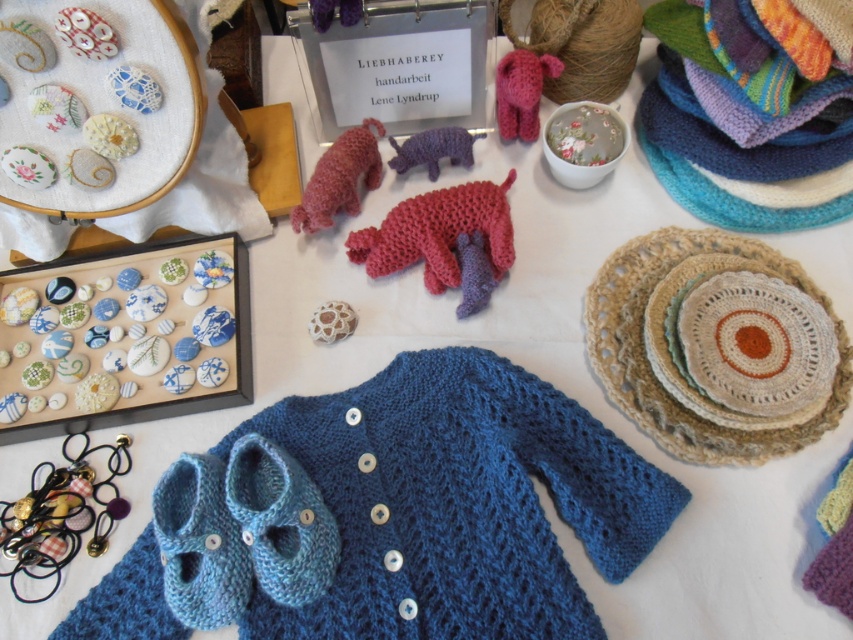
Between knitted wool dog at center and purple knitted toy at center, which one is positioned higher?

purple knitted toy at center is above.

Is knitted wool dog at center to the right of purple knitted toy at center from the viewer's perspective?

Incorrect, knitted wool dog at center is not on the right side of purple knitted toy at center.

Who is more distant from viewer, (291, 227) or (401, 150)?

The point (401, 150) is more distant.

You are a GUI agent. You are given a task and a screenshot of the screen. Output one action in this format:
    pyautogui.click(x=<x>, y=<y>)
    Task: Click on the knitted wool dog at center
    
    Given the screenshot: What is the action you would take?
    pyautogui.click(x=340, y=177)

From the picture: Who is lower down, knitted wool dog at center or knitted pink elephant at upper center?

knitted wool dog at center

Does point (320, 214) come in front of point (518, 54)?

That is True.

Identify the location of knitted wool dog at center. (340, 177).

From the picture: Can you confirm if knitted woolen dog at center is thinner than purple knitted toy at center?

No.

Is knitted woolen dog at center above purple knitted toy at center?

No.

Identify the location of knitted woolen dog at center. (444, 240).

This screenshot has width=853, height=640. I want to click on knitted woolen dog at center, so click(444, 240).